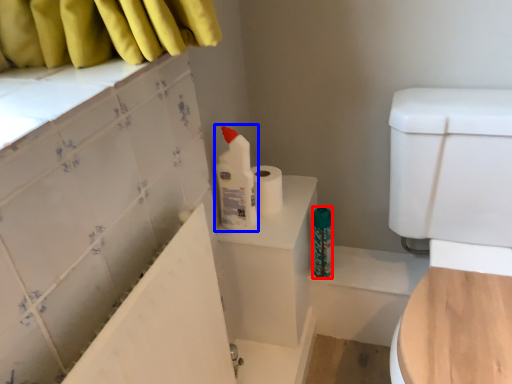
Question: Which point is further to the camera, toiletry (highlighted by a red box) or cleaning product (highlighted by a blue box)?

Choices:
 (A) toiletry
 (B) cleaning product

Answer: (A)